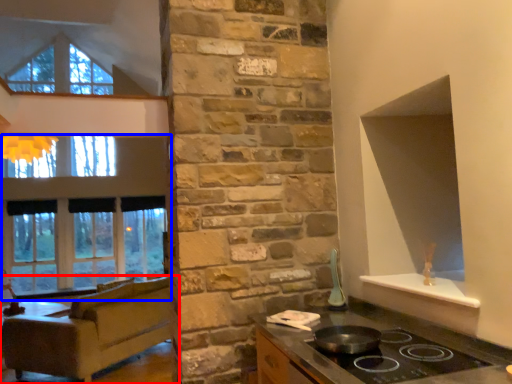
Question: Which of the following is the closest to the observer, studio couch (highlighted by a red box) or window (highlighted by a blue box)?

Choices:
 (A) studio couch
 (B) window

Answer: (A)